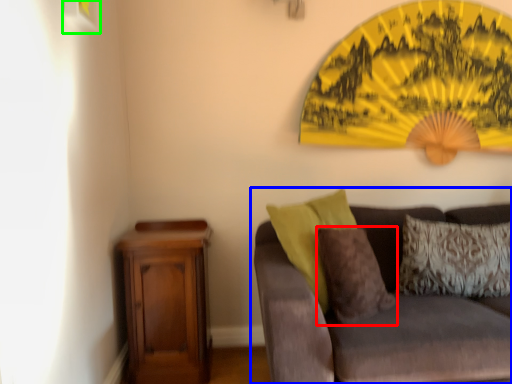
Question: Which object is positioned farthest from pillow (highlighted by a red box)? Select from studio couch (highlighted by a blue box) and picture frame (highlighted by a green box).

Choices:
 (A) studio couch
 (B) picture frame

Answer: (B)